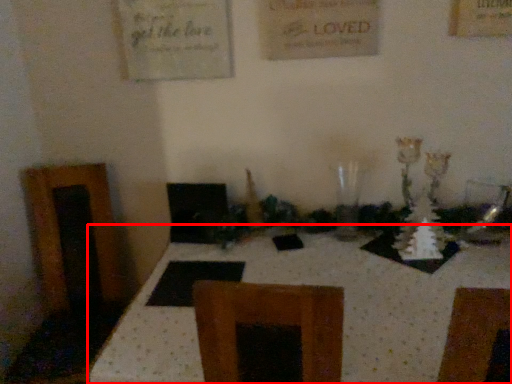
Question: Considering the relative positions of table (annotated by the red box) and glass vase in the image provided, where is table (annotated by the red box) located with respect to the staircase?

Choices:
 (A) left
 (B) right

Answer: (A)